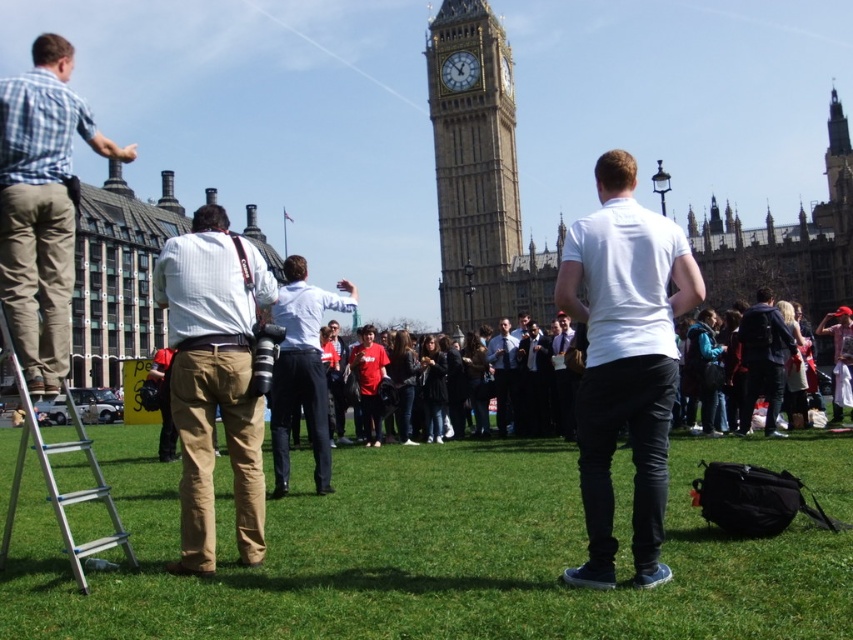
You are a photographer trying to capture a photo of the khaki cotton pants at center and the plaid shirt at left. Which object should you focus on first if you want to ensure both are in sharp focus?

You should focus on the plaid shirt at left first because it is taller than the khaki cotton pants at center, allowing for better depth of field coverage.

You are a photographer at the Elizabeth Tower and want to take a photo that includes both the khaki cotton pants at center and the plaid shirt at left. Based on their positions, which one should be placed on the left side of the photo to ensure both are visible?

The plaid shirt at left should be placed on the left side of the photo since the khaki cotton pants at center is positioned on the right side of it, ensuring both are visible in the frame.

You are a tourist visiting Big Ben and want to place your dark blue backpack at center on the ground. Is there enough space on the green grass at center to place it without it falling off?

The green grass at center is located below the dark blue backpack at center, so placing the dark blue backpack at center on the green grass at center would be stable as the grass is beneath it.